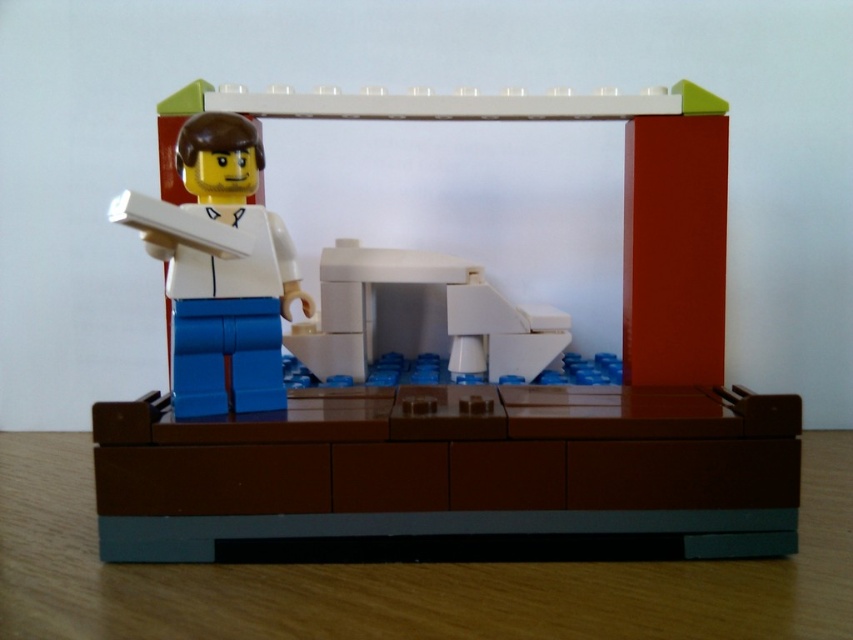
Question: Among these objects, which one is nearest to the camera?

Choices:
 (A) white plastic microwave at center
 (B) white matte minifigure at center
 (C) white plastic minifigure at center

Answer: (B)

Question: Considering the real-world distances, which object is farthest from the white matte minifigure at center?

Choices:
 (A) white plastic microwave at center
 (B) white plastic minifigure at center

Answer: (A)

Question: Does white matte minifigure at center appear under white plastic microwave at center?

Choices:
 (A) no
 (B) yes

Answer: (A)

Question: Can you confirm if white matte minifigure at center is smaller than white plastic microwave at center?

Choices:
 (A) no
 (B) yes

Answer: (B)

Question: Which object appears farthest from the camera in this image?

Choices:
 (A) white plastic minifigure at center
 (B) white matte minifigure at center

Answer: (A)

Question: Does white matte minifigure at center appear under white plastic microwave at center?

Choices:
 (A) no
 (B) yes

Answer: (A)